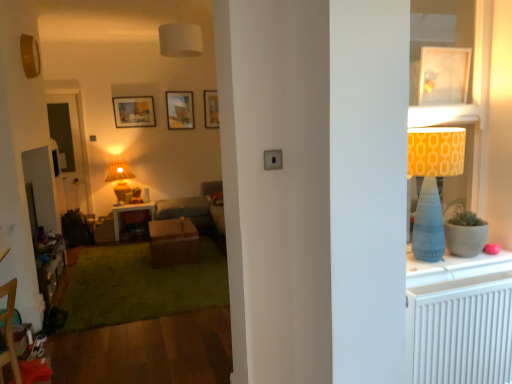
Question: Can you confirm if wooden dresser at lower left is wider than wooden picture frame at upper center, the 1th picture frame when ordered from back to front?

Choices:
 (A) no
 (B) yes

Answer: (B)

Question: From the image's perspective, is wooden dresser at lower left located above wooden picture frame at upper center, which is counted as the 2th picture frame, starting from the right?

Choices:
 (A) yes
 (B) no

Answer: (B)

Question: Is there a large distance between wooden dresser at lower left and wooden picture frame at upper center, which is counted as the 2th picture frame, starting from the right?

Choices:
 (A) yes
 (B) no

Answer: (A)

Question: Is wooden dresser at lower left to the left of wooden picture frame at upper center, which is counted as the 2th picture frame, starting from the right, from the viewer's perspective?

Choices:
 (A) no
 (B) yes

Answer: (B)

Question: From a real-world perspective, is wooden dresser at lower left on wooden picture frame at upper center, which is counted as the third picture frame, starting from the left?

Choices:
 (A) yes
 (B) no

Answer: (B)

Question: From a real-world perspective, is wooden dresser at lower left positioned under wooden picture frame at upper center, the 1th picture frame when ordered from back to front, based on gravity?

Choices:
 (A) no
 (B) yes

Answer: (B)

Question: Considering the relative sizes of matte wooden picture frame at upper center, which is the second picture frame in front-to-back order, and textured gray couch at center in the image provided, is matte wooden picture frame at upper center, which is the second picture frame in front-to-back order, smaller than textured gray couch at center?

Choices:
 (A) no
 (B) yes

Answer: (B)

Question: Is matte wooden picture frame at upper center, placed as the 4th picture frame when sorted from right to left, taller than textured gray couch at center?

Choices:
 (A) yes
 (B) no

Answer: (B)

Question: Considering the relative sizes of matte wooden picture frame at upper center, placed as the 4th picture frame when sorted from right to left, and textured gray couch at center in the image provided, is matte wooden picture frame at upper center, placed as the 4th picture frame when sorted from right to left, bigger than textured gray couch at center?

Choices:
 (A) yes
 (B) no

Answer: (B)

Question: Is matte wooden picture frame at upper center, placed as the 4th picture frame when sorted from right to left, in front of textured gray couch at center?

Choices:
 (A) yes
 (B) no

Answer: (B)

Question: Is matte wooden picture frame at upper center, placed as the 4th picture frame when sorted from right to left, to the right of textured gray couch at center from the viewer's perspective?

Choices:
 (A) no
 (B) yes

Answer: (A)

Question: From the image's perspective, is matte wooden picture frame at upper center, which is the second picture frame in front-to-back order, on textured gray couch at center?

Choices:
 (A) no
 (B) yes

Answer: (B)

Question: Considering the relative sizes of white glossy picture frame at upper right, the 1th picture frame in the front-to-back sequence, and wooden dresser at lower left in the image provided, is white glossy picture frame at upper right, the 1th picture frame in the front-to-back sequence, bigger than wooden dresser at lower left?

Choices:
 (A) yes
 (B) no

Answer: (B)